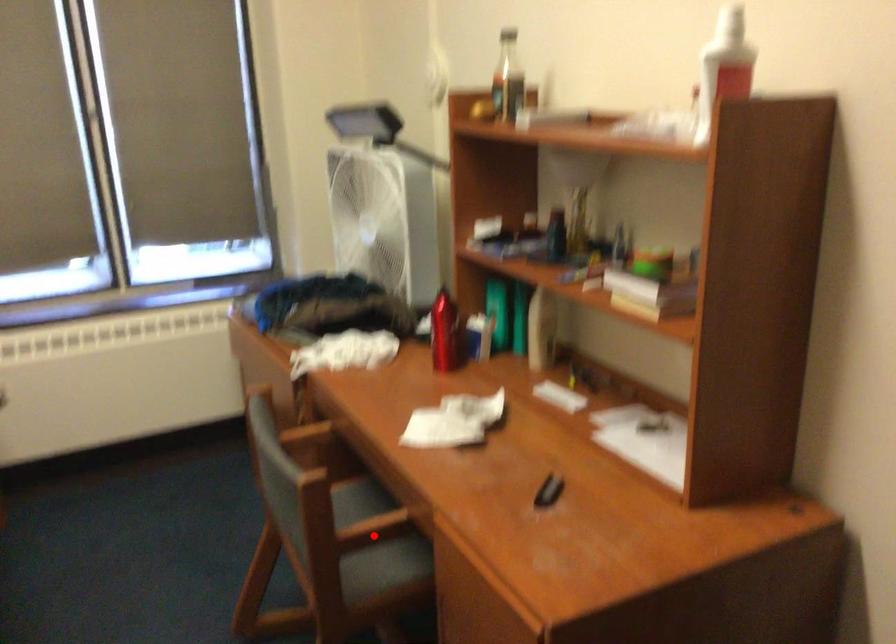
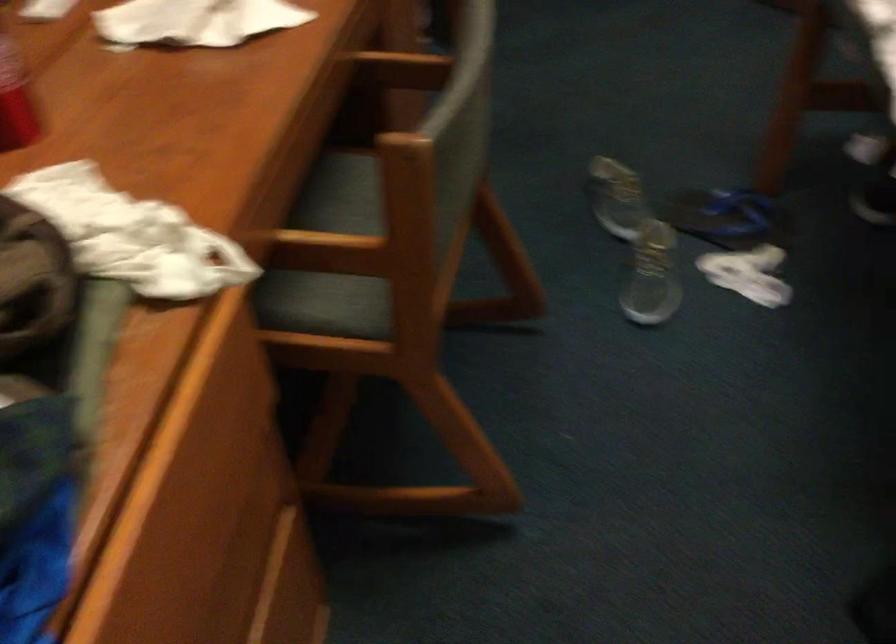
Locate, in the second image, the point that corresponds to the highlighted location in the first image.

(401, 69)